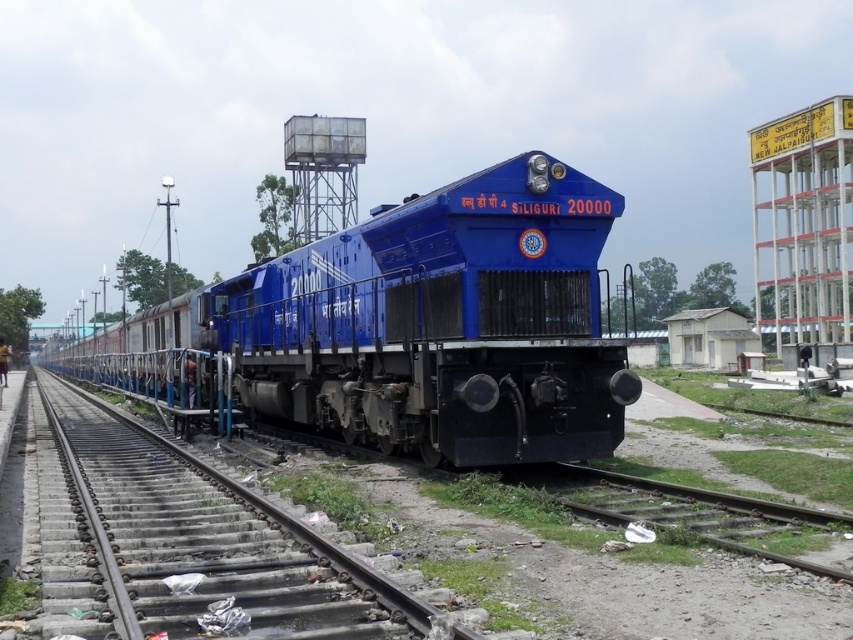
Question: Is blue metallic locomotive at center smaller than smooth metal train track at center?

Choices:
 (A) no
 (B) yes

Answer: (A)

Question: Does blue metallic locomotive at center have a larger size compared to metallic water tower at upper center?

Choices:
 (A) no
 (B) yes

Answer: (B)

Question: Which point is farther to the camera?

Choices:
 (A) (532, 308)
 (B) (297, 209)
 (C) (119, 424)

Answer: (B)

Question: Which object appears closest to the camera in this image?

Choices:
 (A) smooth metal train track at center
 (B) blue metallic locomotive at center
 (C) metallic water tower at upper center
 (D) gravelly dirt track at lower right

Answer: (A)

Question: Which object is farther from the camera taking this photo?

Choices:
 (A) gravelly dirt track at lower right
 (B) metallic water tower at upper center

Answer: (B)

Question: Is gravelly dirt track at lower right to the right of metallic water tower at upper center from the viewer's perspective?

Choices:
 (A) no
 (B) yes

Answer: (B)